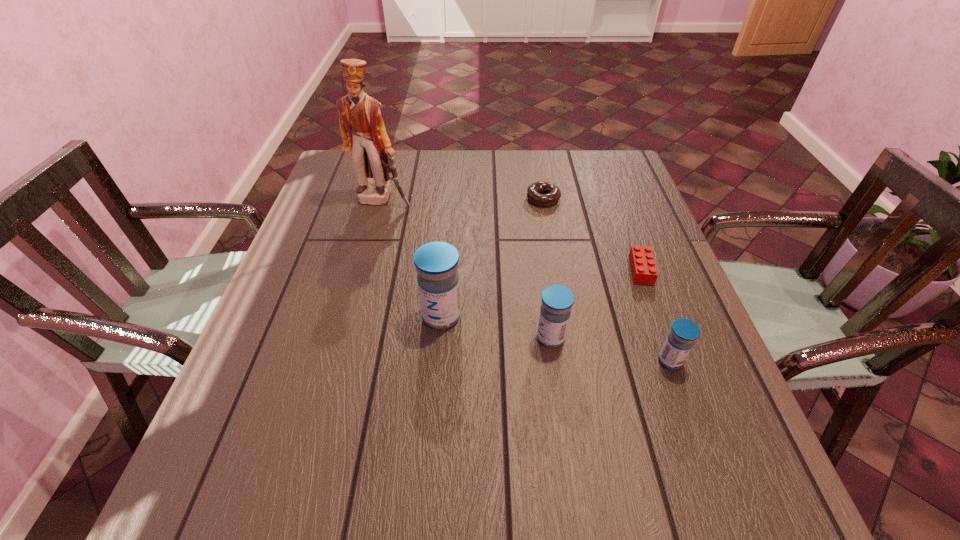
Locate an element on the screen. free spot between the doughnut and the Lego is located at coordinates (592, 234).

This screenshot has height=540, width=960. What are the coordinates of `vacant area between the doughnut and the nutcracker` in the screenshot? It's located at (463, 199).

Image resolution: width=960 pixels, height=540 pixels. Identify the location of free space that is in between the second tallest object and the doughnut. (492, 258).

Locate an element on the screen. The width and height of the screenshot is (960, 540). free spot between the doughnut and the Lego is located at coordinates (592, 234).

Where is `free space between the fifth shortest object and the doughnut`? free space between the fifth shortest object and the doughnut is located at coordinates (492, 258).

Identify the location of vacant area that lies between the nearest medicine and the doughnut. This screenshot has height=540, width=960. (607, 280).

Identify the location of vacant space in between the third shortest object and the doughnut. The image size is (960, 540). (607, 280).

This screenshot has height=540, width=960. What are the coordinates of `the fourth closest object to the fourth shortest object` in the screenshot? It's located at (552, 194).

Identify the location of object that ranks as the fourth closest to the third shortest object. (552, 194).

This screenshot has width=960, height=540. What are the coordinates of `medicine identified as the second closest to the second medicine from left to right` in the screenshot? It's located at (680, 340).